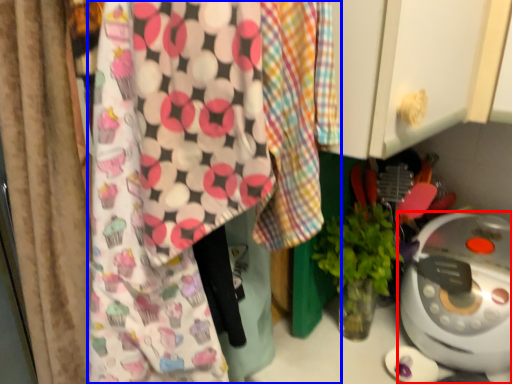
Question: Which object is closer to the camera taking this photo, home appliance (highlighted by a red box) or wrapping paper (highlighted by a blue box)?

Choices:
 (A) home appliance
 (B) wrapping paper

Answer: (B)